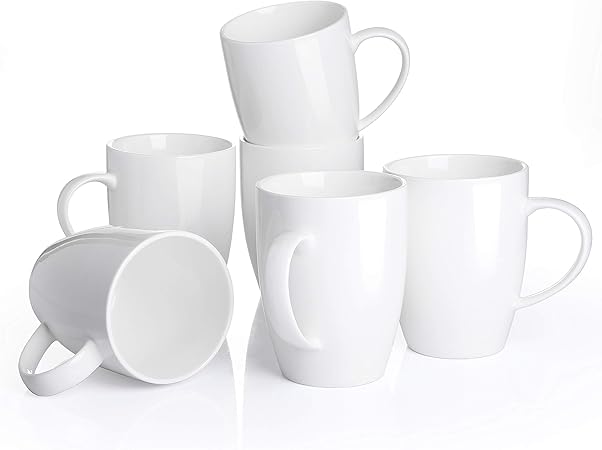
Locate an element on the screen. The width and height of the screenshot is (602, 450). coffee cups is located at coordinates (81, 308), (150, 184), (305, 95), (270, 159), (341, 235), (489, 234).